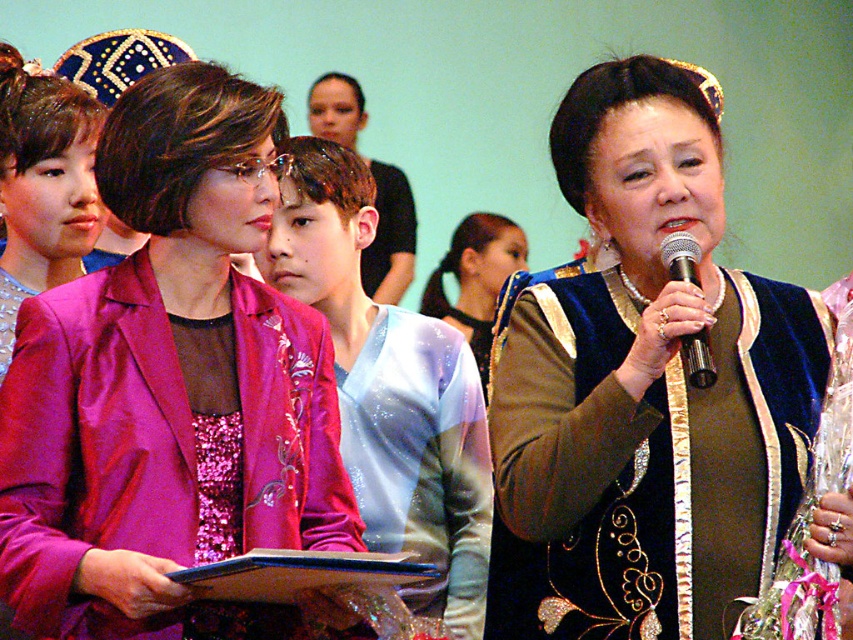
Which is below, pink satin jacket at center or metallic silver microphone at upper center?

Positioned lower is pink satin jacket at center.

Between point (312, 392) and point (672, 280), which one is positioned in front?

Point (672, 280) is more forward.

This screenshot has height=640, width=853. Identify the location of pink satin jacket at center. (167, 385).

Is velvet brown dress at center closer to camera compared to pink satin jacket at center?

Yes, it is.

Between velvet brown dress at center and pink satin jacket at center, which one is positioned higher?

velvet brown dress at center

Identify the location of velvet brown dress at center. (645, 387).

Where is `velvet brown dress at center`? velvet brown dress at center is located at coordinates (645, 387).

Is point (426, 305) positioned before point (693, 378)?

That is False.

How far apart are velvet blue dress at center and metallic silver microphone at upper center?

velvet blue dress at center and metallic silver microphone at upper center are 9.72 feet apart.

Is point (485, 328) more distant than point (708, 376)?

Yes, point (485, 328) is behind point (708, 376).

You are a GUI agent. You are given a task and a screenshot of the screen. Output one action in this format:
    pyautogui.click(x=<x>, y=<y>)
    Task: Click on the velvet blue dress at center
    
    Given the screenshot: What is the action you would take?
    pyautogui.click(x=476, y=278)